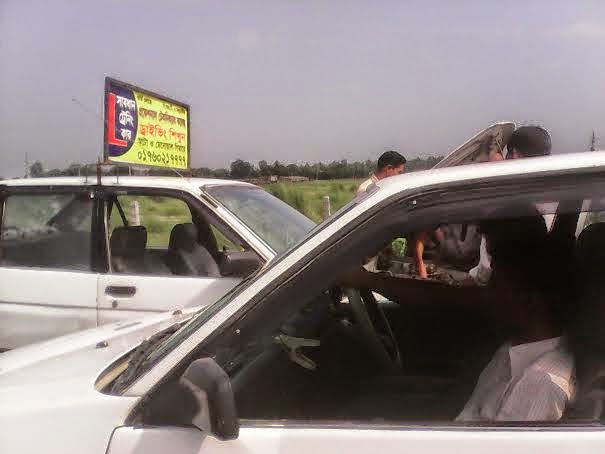
You are a GUI agent. You are given a task and a screenshot of the screen. Output one action in this format:
    pyautogui.click(x=<x>, y=<y>)
    Task: Click on the back of mirror
    This screenshot has width=605, height=454.
    Given the screenshot: What is the action you would take?
    pyautogui.click(x=201, y=391)